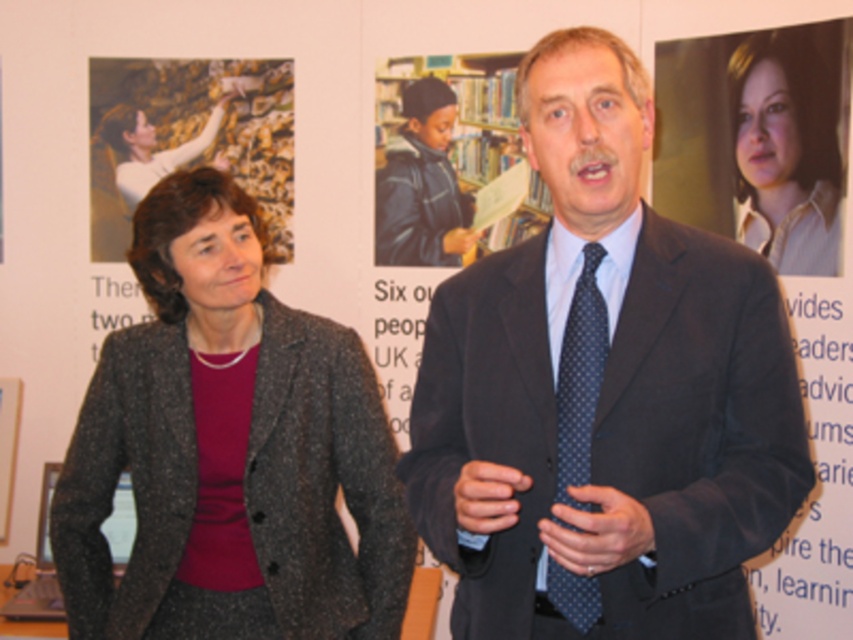
Question: Does dark gray suit at center have a larger size compared to wooden bookshelf at center?

Choices:
 (A) no
 (B) yes

Answer: (B)

Question: Which of these objects is positioned closest to the dark gray textured blazer at left?

Choices:
 (A) dark gray suit at center
 (B) dark blue dotted tie at center

Answer: (A)

Question: Which of the following is the closest to the observer?

Choices:
 (A) click(x=590, y=307)
 (B) click(x=730, y=92)
 (C) click(x=595, y=196)

Answer: (C)

Question: Does dark gray suit at center appear on the left side of dark blue dotted tie at center?

Choices:
 (A) no
 (B) yes

Answer: (A)

Question: Can you confirm if light brown shirt at upper right is wider than dark blue dotted tie at center?

Choices:
 (A) yes
 (B) no

Answer: (A)

Question: Based on their relative distances, which object is nearer to the wooden bookshelf at center?

Choices:
 (A) light brown shirt at upper right
 (B) dark blue dotted tie at center
 (C) dark gray suit at center
 (D) dark gray textured blazer at left

Answer: (A)